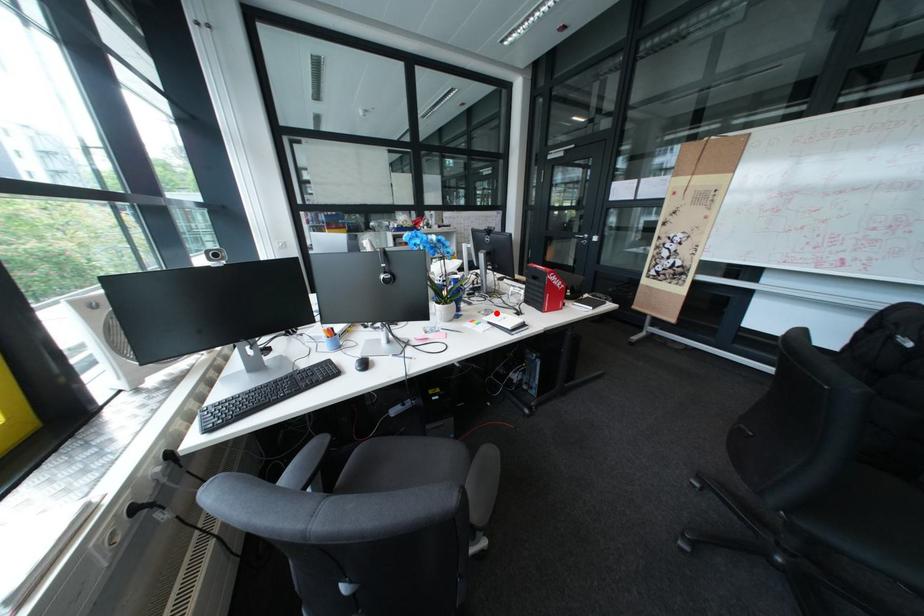
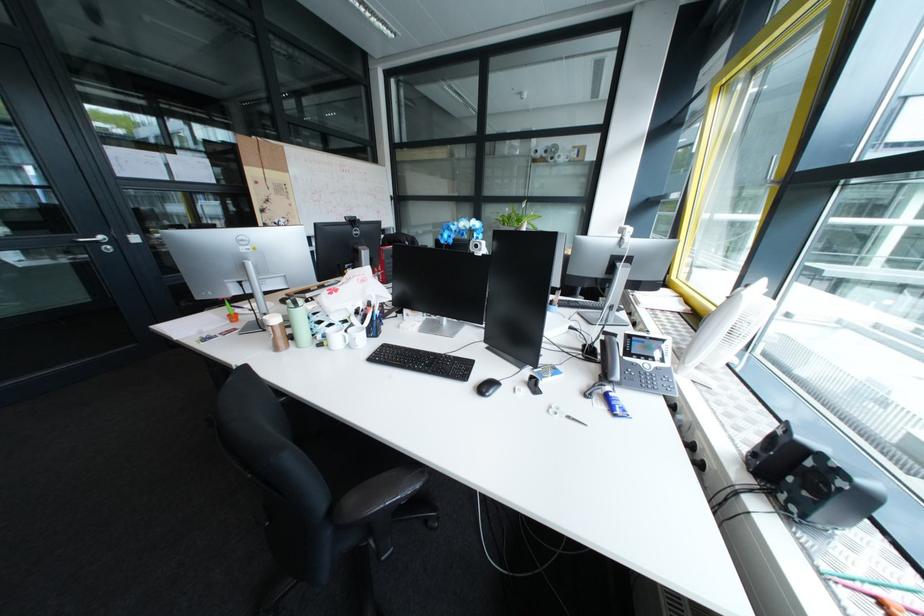
Question: I am providing you with two images of the same scene from different viewpoints. A red point is marked on the first image. At the location where the point appears in image 1, is it still visible in image 2?

Choices:
 (A) Yes
 (B) No

Answer: (B)